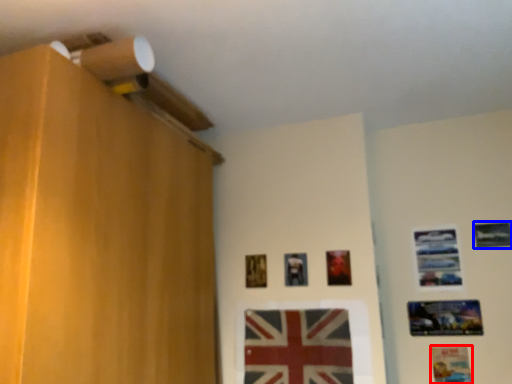
Question: Which object is closer to the camera taking this photo, picture frame (highlighted by a red box) or picture frame (highlighted by a blue box)?

Choices:
 (A) picture frame
 (B) picture frame

Answer: (A)